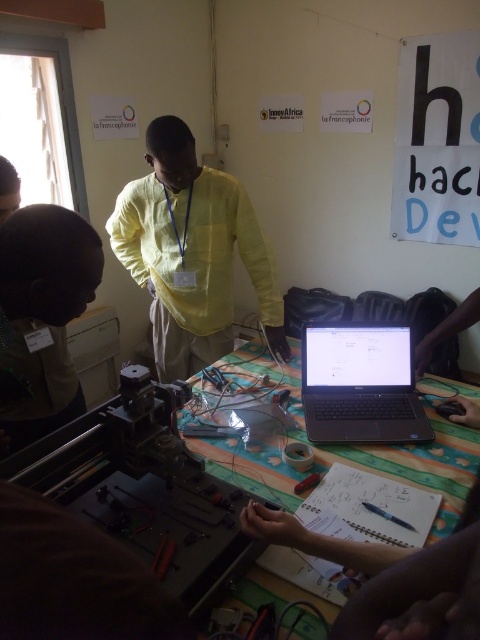
Question: Which object is positioned farthest from the yellow cotton shirt at center?

Choices:
 (A) green fabric table at center
 (B) sleek black laptop at center
 (C) metallic red screwdriver at center
 (D) matte black head at lower left

Answer: (C)

Question: Does matte black head at lower left have a lesser width compared to metallic red screwdriver at center?

Choices:
 (A) no
 (B) yes

Answer: (A)

Question: Based on their relative distances, which object is nearer to the matte black head at lower left?

Choices:
 (A) brown leather cap at upper left
 (B) metallic gray machine at center
 (C) sleek black laptop at center

Answer: (B)

Question: In this image, where is brown leather cap at upper left located relative to metallic red screwdriver at center?

Choices:
 (A) above
 (B) below

Answer: (A)

Question: Is yellow cotton shirt at center bigger than metallic red screwdriver at center?

Choices:
 (A) yes
 (B) no

Answer: (A)

Question: Considering the real-world distances, which object is closest to the metallic gray machine at center?

Choices:
 (A) yellow cotton shirt at center
 (B) matte black head at lower left

Answer: (B)